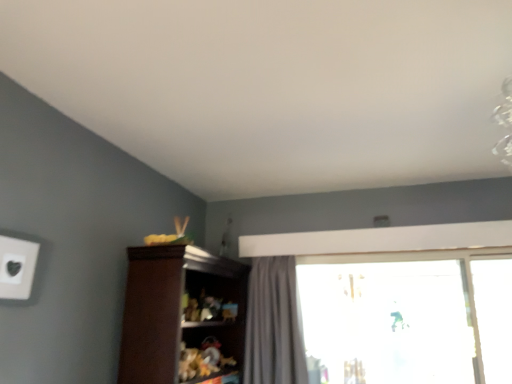
What are the coordinates of `transparent glass window at center` in the screenshot? It's located at (377, 241).

Locate an element on the screen. The width and height of the screenshot is (512, 384). brown wood cupboard at center is located at coordinates (182, 315).

Relative to brown wood cupboard at center, is gray fabric curtain at center in front or behind?

In the image, gray fabric curtain at center appears behind brown wood cupboard at center.

Who is smaller, gray fabric curtain at center or brown wood cupboard at center?

gray fabric curtain at center is smaller.

The height and width of the screenshot is (384, 512). Find the location of `curtain behind the brown wood cupboard at center`. curtain behind the brown wood cupboard at center is located at coordinates [274, 324].

Choose the correct answer: Is gray fabric curtain at center inside brown wood cupboard at center or outside it?

gray fabric curtain at center is not inside brown wood cupboard at center, it's outside.

Can you tell me how much white matte electric outlet at upper left and transparent glass window at center differ in facing direction?

The angular difference between white matte electric outlet at upper left and transparent glass window at center is 89.9 degrees.

Which is in front, white matte electric outlet at upper left or transparent glass window at center?

white matte electric outlet at upper left.

Which is in front, point (12, 277) or point (260, 294)?

The point (12, 277) is more forward.

How distant is white matte electric outlet at upper left from transparent glass window at center?

white matte electric outlet at upper left is 5.61 feet from transparent glass window at center.

From a real-world perspective, is white matte electric outlet at upper left above or below gray fabric curtain at center?

From a real-world perspective, white matte electric outlet at upper left is physically above gray fabric curtain at center.

Considering the sizes of objects white matte electric outlet at upper left and gray fabric curtain at center in the image provided, who is wider, white matte electric outlet at upper left or gray fabric curtain at center?

With larger width is gray fabric curtain at center.

Does white matte electric outlet at upper left appear on the right side of gray fabric curtain at center?

Incorrect, white matte electric outlet at upper left is not on the right side of gray fabric curtain at center.

Who is bigger, brown wood cupboard at center or white matte electric outlet at upper left?

Bigger between the two is brown wood cupboard at center.

From a real-world perspective, between brown wood cupboard at center and white matte electric outlet at upper left, who is vertically higher?

In real-world perspective, white matte electric outlet at upper left is above.

Considering the points (155, 266) and (8, 249), which point is in front, point (155, 266) or point (8, 249)?

The point (8, 249) is closer.

Is brown wood cupboard at center at the right side of transparent glass window at center?

No.

Is brown wood cupboard at center situated inside transparent glass window at center or outside?

brown wood cupboard at center is outside transparent glass window at center.

Does brown wood cupboard at center have a larger size compared to transparent glass window at center?

Correct, brown wood cupboard at center is larger in size than transparent glass window at center.

Between brown wood cupboard at center and transparent glass window at center, which one has less height?

brown wood cupboard at center is shorter.

Which is farther from the camera, (x=2, y=282) or (x=218, y=308)?

The point (x=218, y=308) is behind.

From a real-world perspective, is white matte electric outlet at upper left physically above brown wood cupboard at center?

Yes, from a real-world perspective, white matte electric outlet at upper left is above brown wood cupboard at center.

From the image's perspective, which one is positioned higher, white matte electric outlet at upper left or brown wood cupboard at center?

white matte electric outlet at upper left is shown above in the image.

Is transparent glass window at center positioned beyond the bounds of brown wood cupboard at center?

Yes, transparent glass window at center is outside of brown wood cupboard at center.

Can you tell me how much transparent glass window at center and brown wood cupboard at center differ in facing direction?

90.6 degrees.

Visually, is transparent glass window at center positioned to the left or to the right of brown wood cupboard at center?

transparent glass window at center is positioned on brown wood cupboard at center's right side.

Is point (403, 231) positioned in front of point (127, 309)?

No, (403, 231) is further to viewer.

You are a GUI agent. You are given a task and a screenshot of the screen. Output one action in this format:
    pyautogui.click(x=<x>, y=<y>)
    Task: Click on the curtain behind the brown wood cupboard at center
    
    Given the screenshot: What is the action you would take?
    pyautogui.click(x=274, y=324)

Locate an element on the screen. This screenshot has height=384, width=512. electric outlet on the left of transparent glass window at center is located at coordinates (17, 267).

Estimate the real-world distances between objects in this image. Which object is closer to white matte electric outlet at upper left, gray fabric curtain at center or brown wood cupboard at center?

brown wood cupboard at center is positioned closer to the anchor white matte electric outlet at upper left.

Considering their positions, is transparent glass window at center positioned closer to white matte electric outlet at upper left than brown wood cupboard at center?

Based on the image, brown wood cupboard at center appears to be nearer to white matte electric outlet at upper left.

Consider the image. From the image, which object appears to be farther from gray fabric curtain at center, brown wood cupboard at center or transparent glass window at center?

The object further to gray fabric curtain at center is brown wood cupboard at center.

Looking at the image, which one is located closer to white matte electric outlet at upper left, brown wood cupboard at center or transparent glass window at center?

Among the two, brown wood cupboard at center is located nearer to white matte electric outlet at upper left.

Looking at the image, which one is located further to gray fabric curtain at center, brown wood cupboard at center or white matte electric outlet at upper left?

Based on the image, white matte electric outlet at upper left appears to be further to gray fabric curtain at center.

Based on the photo, when comparing their distances from brown wood cupboard at center, does white matte electric outlet at upper left or gray fabric curtain at center seem closer?

gray fabric curtain at center is closer to brown wood cupboard at center.

Looking at the image, which one is located closer to transparent glass window at center, gray fabric curtain at center or white matte electric outlet at upper left?

gray fabric curtain at center lies closer to transparent glass window at center than the other object.

Looking at the image, which one is located closer to gray fabric curtain at center, white matte electric outlet at upper left or transparent glass window at center?

transparent glass window at center is positioned closer to the anchor gray fabric curtain at center.

Image resolution: width=512 pixels, height=384 pixels. What are the coordinates of `cupboard between white matte electric outlet at upper left and transparent glass window at center in the horizontal direction` in the screenshot? It's located at (182, 315).

Where is `cupboard between white matte electric outlet at upper left and gray fabric curtain at center along the z-axis`? cupboard between white matte electric outlet at upper left and gray fabric curtain at center along the z-axis is located at coordinates (182, 315).

Where is `curtain located between white matte electric outlet at upper left and transparent glass window at center in the left-right direction`? The width and height of the screenshot is (512, 384). curtain located between white matte electric outlet at upper left and transparent glass window at center in the left-right direction is located at coordinates (274, 324).

This screenshot has height=384, width=512. Identify the location of curtain located between brown wood cupboard at center and transparent glass window at center in the left-right direction. (274, 324).